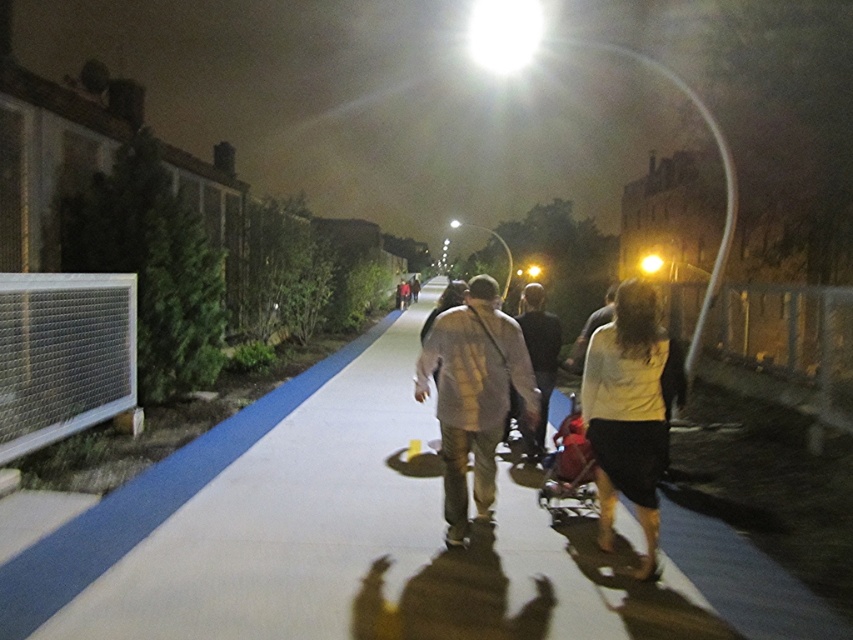
Question: Can you confirm if light gray fabric jacket at center is bigger than dark gray fabric jacket at center?

Choices:
 (A) yes
 (B) no

Answer: (B)

Question: Is white matte shirt at center closer to camera compared to white cotton shirt at center?

Choices:
 (A) no
 (B) yes

Answer: (A)

Question: Is red fabric baby carriage at center below light brown leather jacket at center?

Choices:
 (A) no
 (B) yes

Answer: (B)

Question: Which is farther from the white cotton shirt at center?

Choices:
 (A) blue smooth pavement at center
 (B) light brown leather jacket at center
 (C) red fabric baby carriage at center

Answer: (B)

Question: Among these points, which one is nearest to the camera?

Choices:
 (A) (538, 388)
 (B) (630, 568)
 (C) (469, 337)

Answer: (B)

Question: Considering the real-world distances, which object is farthest from the red fabric baby carriage at center?

Choices:
 (A) dark gray fabric jacket at center
 (B) blue smooth pavement at center
 (C) light brown leather jacket at center

Answer: (C)